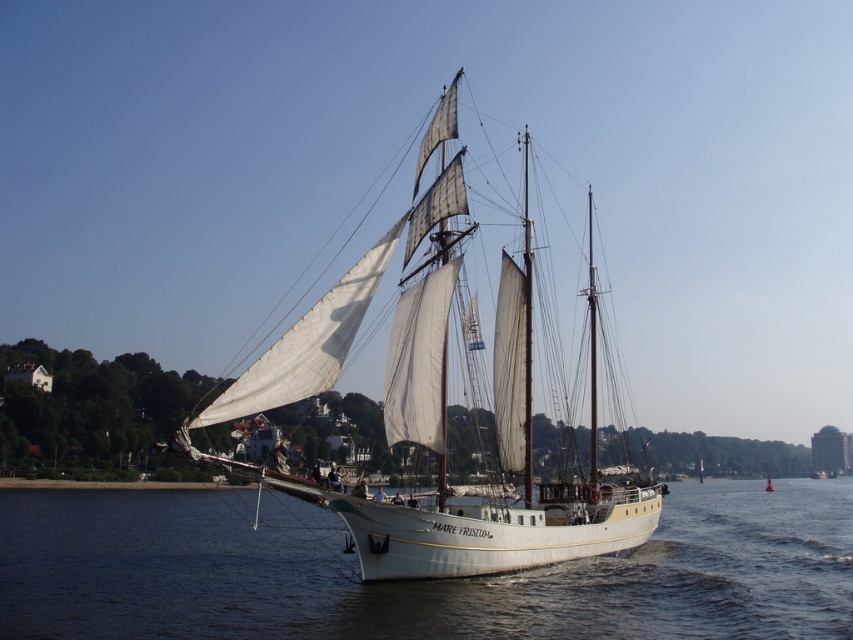
Consider the image. You are a sailor on the MARE FRISTUM. You need to navigate around an obstacle located at coordinates 0.9, 0.5. Is the white water at center in front of or behind the obstacle?

The white water at center is located at point (416, 582), which is very close to the obstacle at (426, 576). Since the coordinates are nearly the same, the white water at center is directly at the obstacle location, so it cannot be determined if it is in front or behind without additional depth information.

You are a sailor on the MARE FRISTUM. You notice both the white water at center and the white canvas sailboat at center. Which object is closer to you?

The white water at center is closer because the white canvas sailboat at center is behind it.